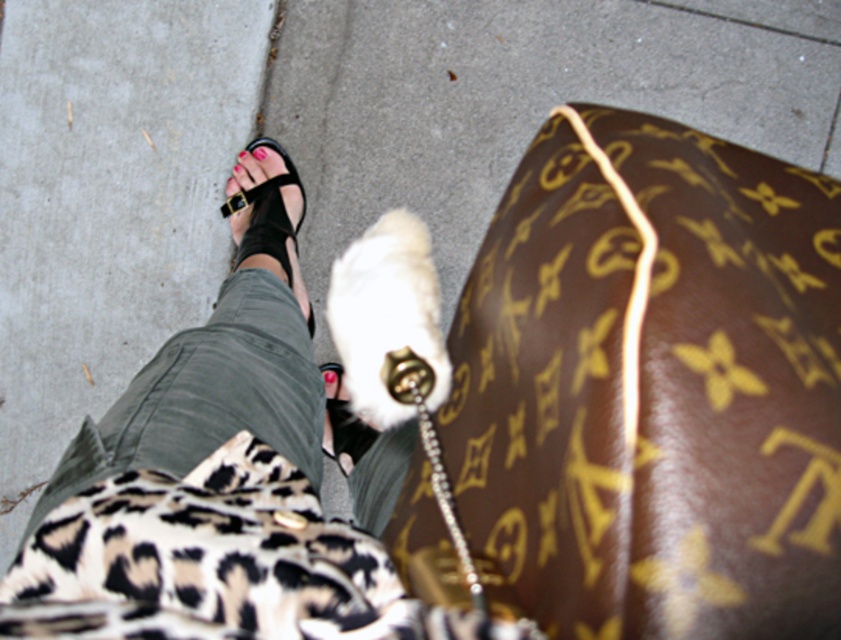
You are standing on the sidewalk and see a black leather sandal at center. Can you tell me what is located at the point with coordinates (267, 212)?

The black leather sandal at center is located at point (267, 212).

You are a photographer standing at a certain distance from the black leather sandal at center. You want to take a photo that includes both the sandal and the white fluffy object near the right leg. Given that the white fluffy object is closer to the camera than the sandal, will the sandal be in focus if you focus on the white fluffy object?

The black leather sandal at center is 1.48 meters from the camera. Since the white fluffy object is closer, focusing on it may leave the sandal out of focus depending on the camera settings. However, if the depth of field is sufficient, both could be in focus. Without specific aperture details, it is uncertain.